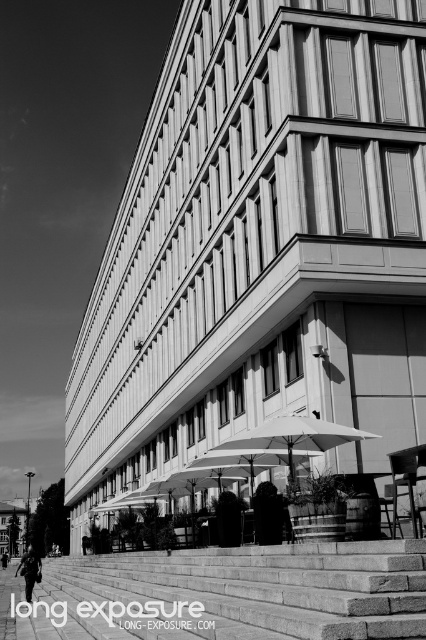
Where is `granite steps at lower center`? Image resolution: width=426 pixels, height=640 pixels. granite steps at lower center is located at coordinates (238, 593).

Measure the distance between point (405, 609) and camera.

Point (405, 609) and camera are 11.42 meters apart.

Is point (296, 636) closer to camera compared to point (245, 445)?

Yes.

Where is `granite steps at lower center`? This screenshot has width=426, height=640. granite steps at lower center is located at coordinates (238, 593).